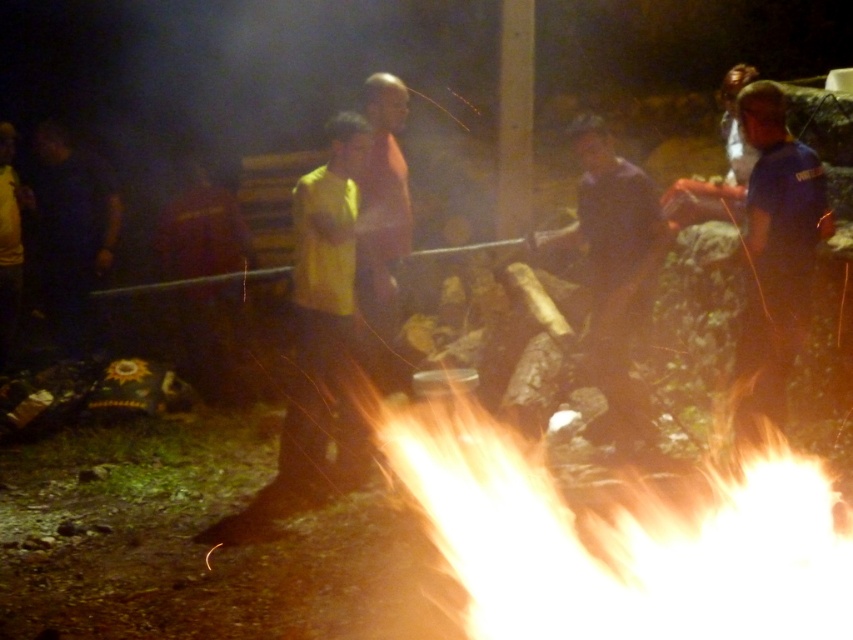
Question: Is bright orange flames at center positioned behind blue cotton shirt at right?

Choices:
 (A) no
 (B) yes

Answer: (A)

Question: Which point appears farthest from the camera in this image?

Choices:
 (A) (612, 634)
 (B) (595, 198)
 (C) (103, 266)
 (D) (775, 156)

Answer: (C)

Question: Considering the real-world distances, which object is closest to the bright orange flames at center?

Choices:
 (A) dark blue fabric at left
 (B) blue cotton shirt at right
 (C) dark brown wood at center
 (D) yellow matte shirt at center

Answer: (B)

Question: Is yellow matte shirt at center in front of blue cotton shirt at right?

Choices:
 (A) yes
 (B) no

Answer: (B)

Question: Can you confirm if dark brown wood at center is smaller than dark blue fabric at left?

Choices:
 (A) no
 (B) yes

Answer: (B)

Question: Which object is the farthest from the dark blue fabric at left?

Choices:
 (A) dark brown wood at center
 (B) yellow matte shirt at center
 (C) bright orange flames at center

Answer: (A)